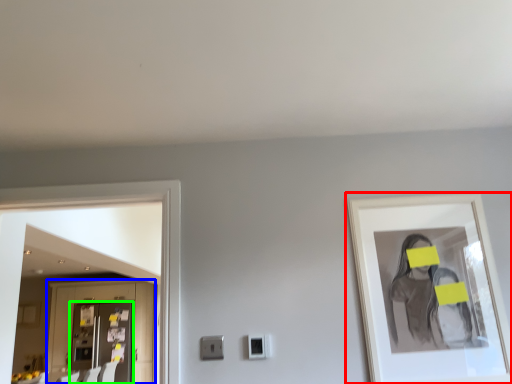
Question: Based on their relative distances, which object is nearer to picture frame (highlighted by a red box)? Choose from cabinetry (highlighted by a blue box) and door (highlighted by a green box).

Choices:
 (A) cabinetry
 (B) door

Answer: (A)